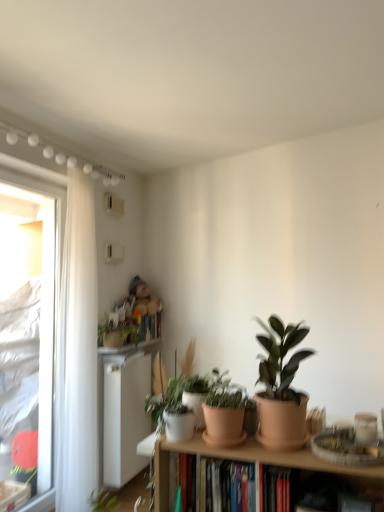
Question: In the image, is transparent plastic window at left positioned in front of or behind white plastic radiator at lower left?

Choices:
 (A) behind
 (B) front

Answer: (B)

Question: From the image's perspective, relative to white plastic radiator at lower left, is transparent plastic window at left above or below?

Choices:
 (A) below
 (B) above

Answer: (B)

Question: Considering the real-world distances, which object is farthest from the white plastic radiator at lower left?

Choices:
 (A) hardcover books at center
 (B) terracotta clay pot at center
 (C) matte terracotta pot at right, which is counted as the third houseplant, starting from the left
 (D) white sheer curtain at left
 (E) green matte plant at upper left, which is the 1th houseplant in back-to-front order

Answer: (C)

Question: Estimate the real-world distances between objects in this image. Which object is farther from the white glossy window sill at upper left?

Choices:
 (A) white sheer curtain at left
 (B) hardcover books at center
 (C) green matte plant at upper left, which is the 1th houseplant in back-to-front order
 (D) terracotta clay pot at center
 (E) white plastic radiator at lower left

Answer: (D)